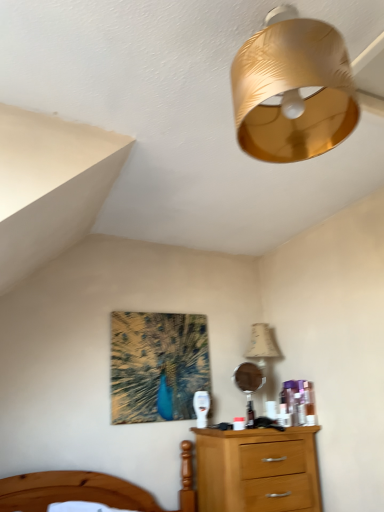
Question: Considering the positions of point (294, 42) and point (238, 384), is point (294, 42) closer or farther from the camera than point (238, 384)?

Choices:
 (A) closer
 (B) farther

Answer: (A)

Question: Would you say gold textured lampshade at upper center is inside or outside metallic round mirror at center?

Choices:
 (A) inside
 (B) outside

Answer: (B)

Question: Estimate the real-world distances between objects in this image. Which object is farther from the beige fabric lampshade at upper right?

Choices:
 (A) wooden bed at lower left
 (B) gold textured lampshade at upper center
 (C) metallic round mirror at center

Answer: (B)

Question: Which is farther from the beige fabric lampshade at upper right?

Choices:
 (A) gold textured lampshade at upper center
 (B) wooden bed at lower left
 (C) metallic round mirror at center

Answer: (A)